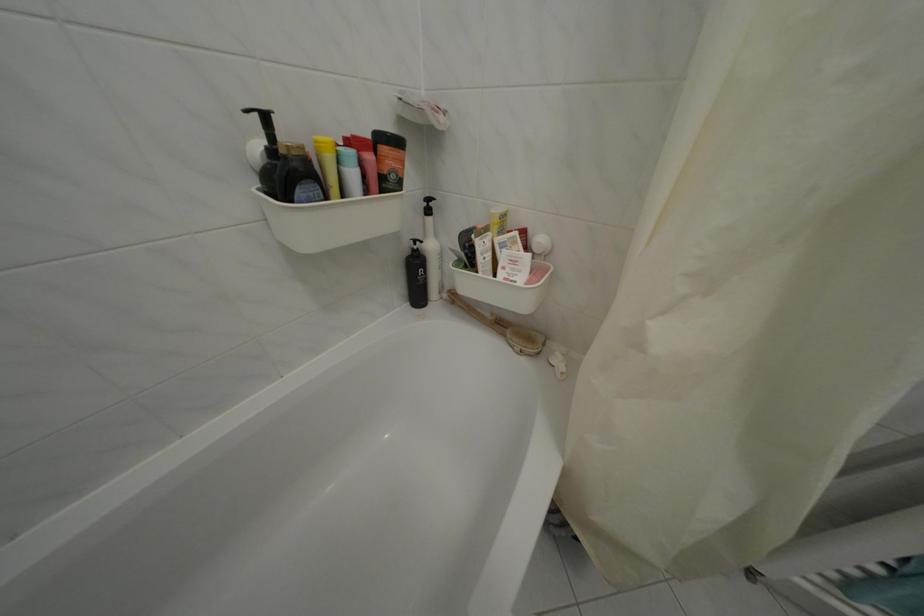
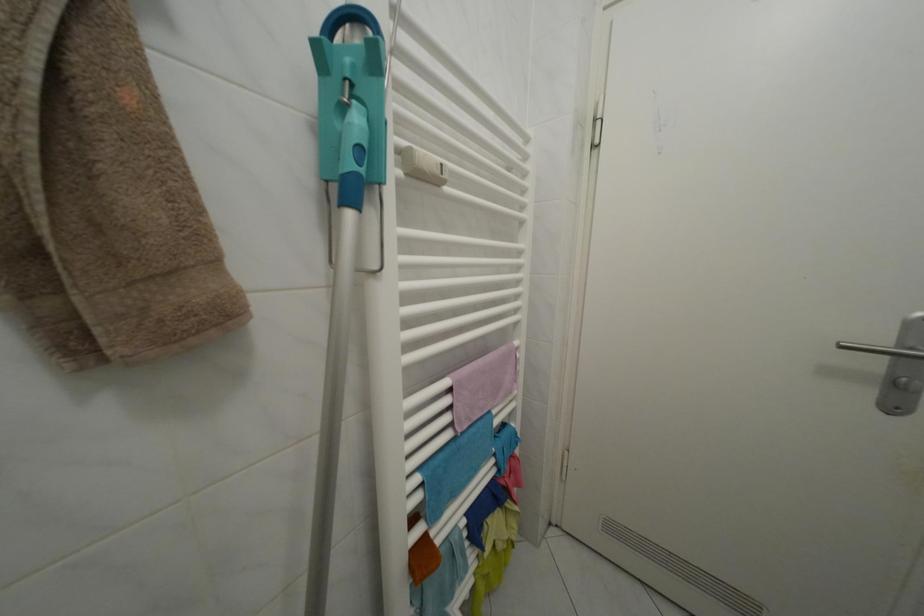
Question: The camera is either moving clockwise (left) or counter-clockwise (right) around the object. The first image is from the beginning of the video and the second image is from the end. Is the camera moving left or right when shooting the video?

Choices:
 (A) Left
 (B) Right

Answer: (A)